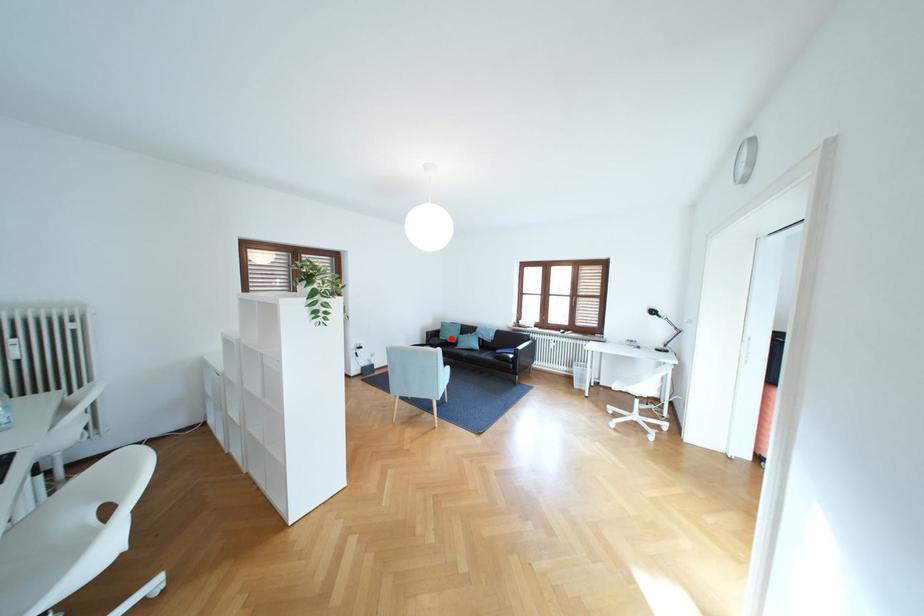
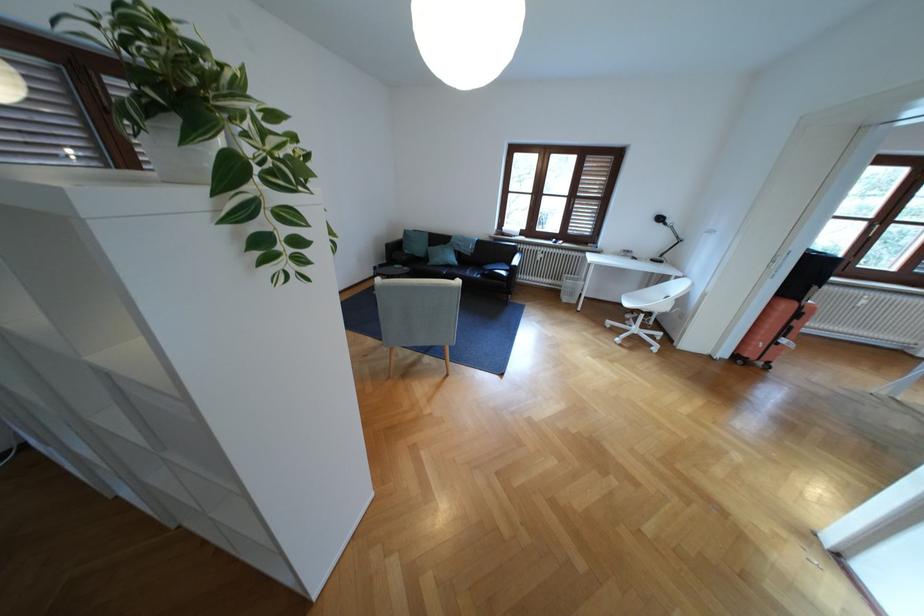
Question: A red point is marked in image1. In image2, is the corresponding 3D point closer to the camera or farther? Reply with the corresponding letter.

Choices:
 (A) The corresponding 3D point is closer.
 (B) The corresponding 3D point is farther.

Answer: (A)